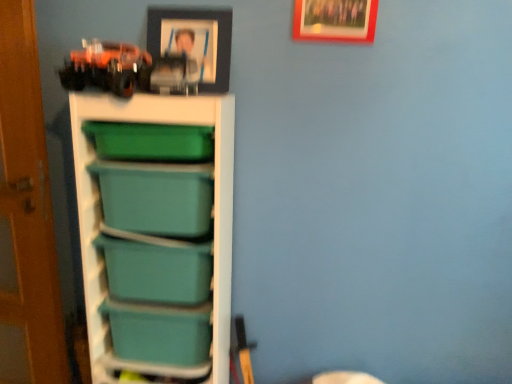
Question: Could you tell me if teal plastic storage at left is facing matte black picture frame at upper center, the 1th picture frame in the left-to-right sequence?

Choices:
 (A) yes
 (B) no

Answer: (B)

Question: Is teal plastic storage at left thinner than matte black picture frame at upper center, arranged as the second picture frame when viewed from the right?

Choices:
 (A) yes
 (B) no

Answer: (B)

Question: Considering the relative sizes of teal plastic storage at left and matte black picture frame at upper center, the 1th picture frame in the left-to-right sequence, in the image provided, is teal plastic storage at left shorter than matte black picture frame at upper center, the 1th picture frame in the left-to-right sequence,?

Choices:
 (A) yes
 (B) no

Answer: (B)

Question: Is the depth of teal plastic storage at left less than that of matte black picture frame at upper center, the 1th picture frame in the left-to-right sequence?

Choices:
 (A) no
 (B) yes

Answer: (B)

Question: Can we say teal plastic storage at left lies outside matte black picture frame at upper center, the 1th picture frame in the left-to-right sequence?

Choices:
 (A) yes
 (B) no

Answer: (A)

Question: From the image's perspective, is wooden picture frame at upper center, which ranks as the first picture frame in right-to-left order, located above or below teal plastic storage at left?

Choices:
 (A) above
 (B) below

Answer: (A)

Question: Considering their positions, is wooden picture frame at upper center, which ranks as the first picture frame in right-to-left order, located in front of or behind teal plastic storage at left?

Choices:
 (A) front
 (B) behind

Answer: (B)

Question: Is wooden picture frame at upper center, which ranks as the first picture frame in right-to-left order, to the left or to the right of teal plastic storage at left in the image?

Choices:
 (A) right
 (B) left

Answer: (A)

Question: In terms of width, does wooden picture frame at upper center, which ranks as the second picture frame in left-to-right order, look wider or thinner when compared to teal plastic storage at left?

Choices:
 (A) thin
 (B) wide

Answer: (A)

Question: From the image's perspective, is matte black picture frame at upper center, the 1th picture frame in the left-to-right sequence, positioned above or below wooden picture frame at upper center, which ranks as the second picture frame in left-to-right order?

Choices:
 (A) below
 (B) above

Answer: (A)

Question: Is matte black picture frame at upper center, the 1th picture frame in the left-to-right sequence, inside or outside of wooden picture frame at upper center, which ranks as the first picture frame in right-to-left order?

Choices:
 (A) outside
 (B) inside

Answer: (A)

Question: In terms of size, does matte black picture frame at upper center, the 1th picture frame in the left-to-right sequence, appear bigger or smaller than wooden picture frame at upper center, which ranks as the first picture frame in right-to-left order?

Choices:
 (A) small
 (B) big

Answer: (B)

Question: From a real-world perspective, relative to wooden picture frame at upper center, which ranks as the second picture frame in left-to-right order, is matte black picture frame at upper center, arranged as the second picture frame when viewed from the right, vertically above or below?

Choices:
 (A) above
 (B) below

Answer: (B)

Question: Would you say teal plastic storage bin at center, placed as the first box when sorted from bottom to top, is inside or outside teal plastic storage at left?

Choices:
 (A) outside
 (B) inside

Answer: (B)

Question: From a real-world perspective, relative to teal plastic storage at left, is teal plastic storage bin at center, the 2th box in the top-to-bottom sequence, vertically above or below?

Choices:
 (A) below
 (B) above

Answer: (A)